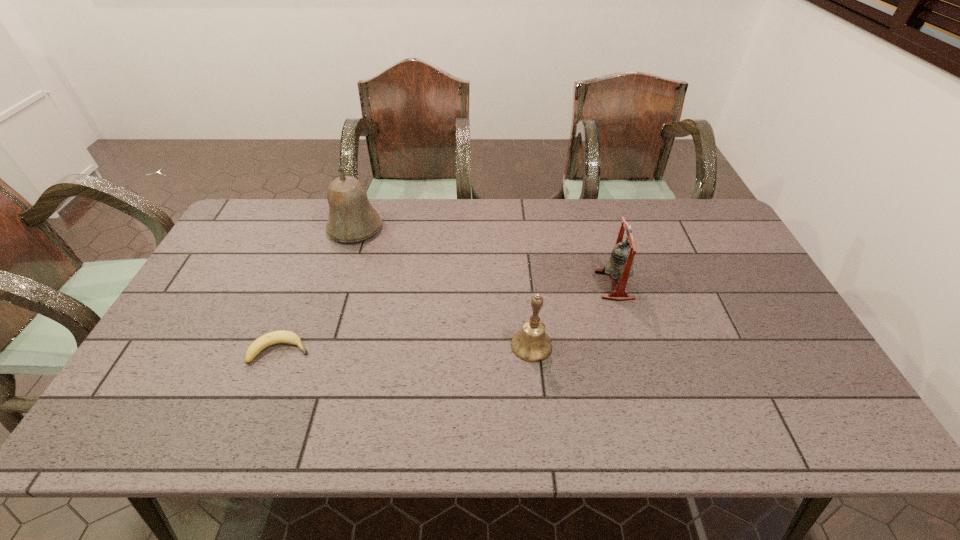
Locate an element on the screen. The height and width of the screenshot is (540, 960). the leftmost bell is located at coordinates (352, 218).

At what (x,y) coordinates should I click in order to perform the action: click on the farthest bell. Please return your answer as a coordinate pair (x, y). Looking at the image, I should click on (352, 218).

The height and width of the screenshot is (540, 960). I want to click on the rightmost object, so click(x=620, y=265).

Where is `the second nearest bell`? the second nearest bell is located at coordinates (620, 265).

The height and width of the screenshot is (540, 960). I want to click on the third object from left to right, so click(531, 344).

Image resolution: width=960 pixels, height=540 pixels. I want to click on the nearest bell, so click(x=531, y=344).

I want to click on the shortest object, so click(282, 336).

The width and height of the screenshot is (960, 540). In order to click on free space located 0.210m on the right of the leftmost bell in this screenshot , I will do `click(444, 228)`.

In order to click on vacant space located 0.250m on the front of the rightmost object in this screenshot , I will do `click(643, 380)`.

At what (x,y) coordinates should I click in order to perform the action: click on free location located 0.100m on the left of the nearest bell. Please return your answer as a coordinate pair (x, y). This screenshot has height=540, width=960. Looking at the image, I should click on (472, 345).